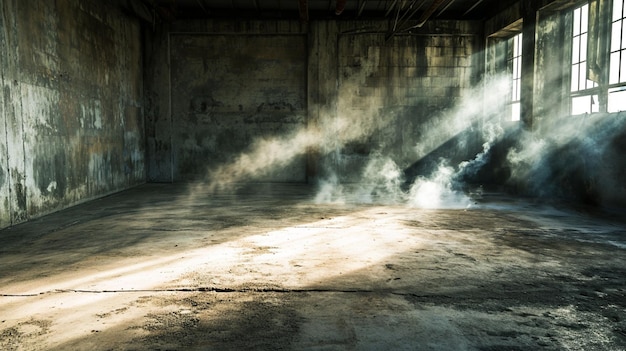
At what (x,y) coordinates should I click in order to perform the action: click on left wall. Please return your answer as a coordinate pair (x, y). Looking at the image, I should click on (39, 165).